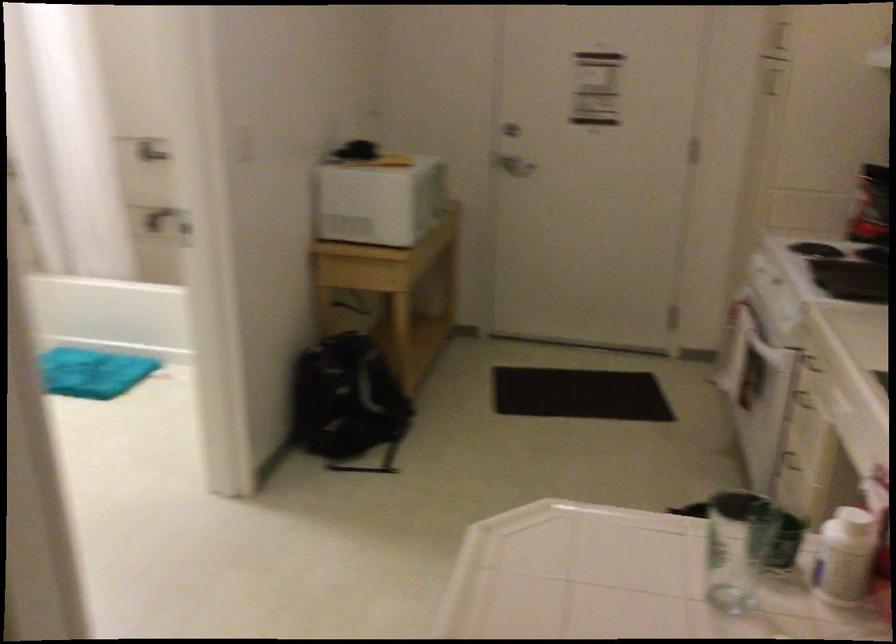
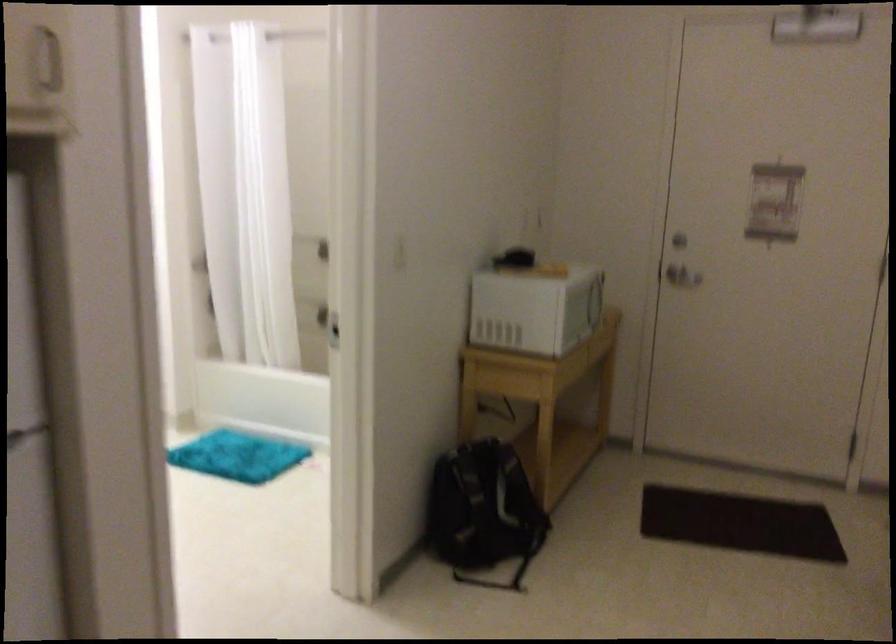
Find the pixel in the second image that matches (x=437, y=191) in the first image.

(596, 301)